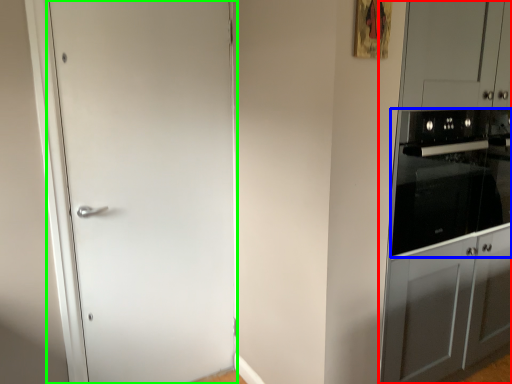
Question: Which object is positioned closest to dresser (highlighted by a red box)? Select from home appliance (highlighted by a blue box) and door (highlighted by a green box).

Choices:
 (A) home appliance
 (B) door

Answer: (A)